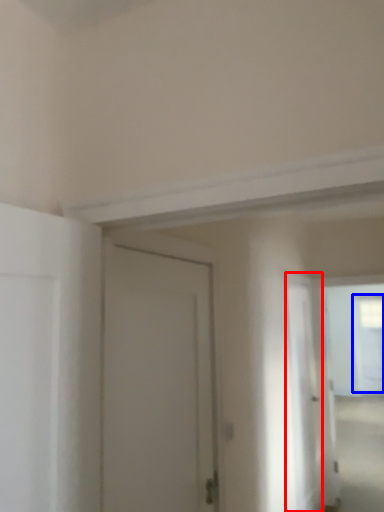
Question: Among these objects, which one is farthest to the camera, screen door (highlighted by a red box) or window (highlighted by a blue box)?

Choices:
 (A) screen door
 (B) window

Answer: (B)